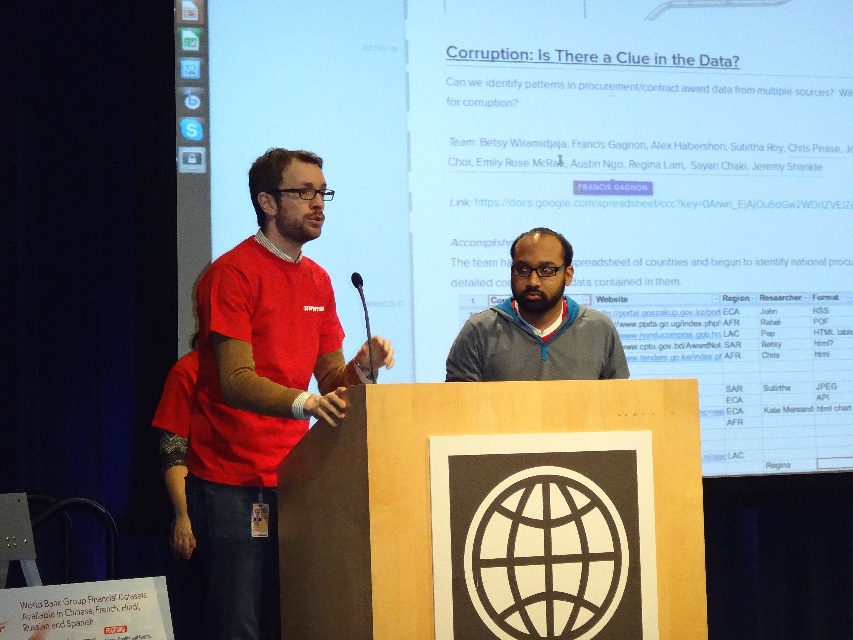
In the scene shown: Is matte red shirt at left shorter than matte gray hoodie at center?

No.

Measure the distance between matte red shirt at left and matte gray hoodie at center.

matte red shirt at left and matte gray hoodie at center are 34.20 inches apart.

Describe the element at coordinates (260, 388) in the screenshot. I see `matte red shirt at left` at that location.

This screenshot has height=640, width=853. I want to click on matte red shirt at left, so click(260, 388).